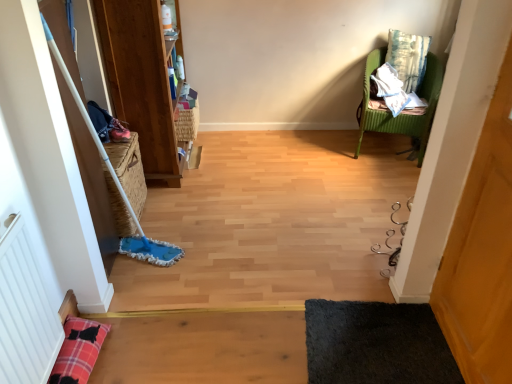
Where is `vacant space in green ribbed chair at upper right (from a real-world perspective)`? vacant space in green ribbed chair at upper right (from a real-world perspective) is located at coordinates (382, 149).